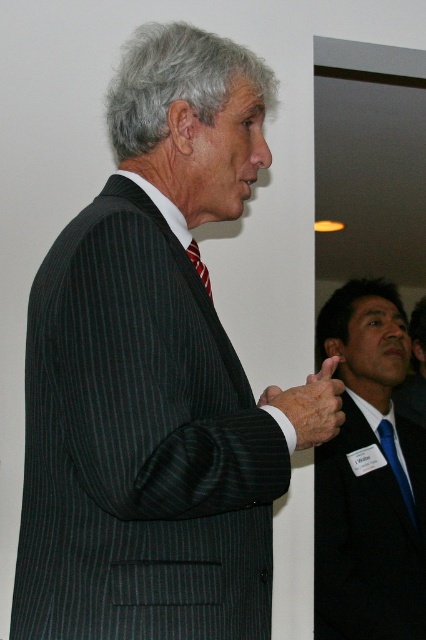
Is point (293, 390) more distant than point (201, 268)?

No, it is not.

Is matte black hand at center closer to the viewer compared to red striped tie at center?

That is True.

Locate an element on the screen. matte black hand at center is located at coordinates (313, 404).

In the scene shown: Can you confirm if matte black hand at center is thinner than blue silk tie at right?

Incorrect, matte black hand at center's width is not less than blue silk tie at right's.

Which is in front, point (307, 406) or point (402, 481)?

Positioned in front is point (307, 406).

Which is in front, point (287, 403) or point (393, 470)?

Point (287, 403)

I want to click on matte black hand at center, so click(313, 404).

Is the position of matte black suit at center more distant than that of matte black hand at center?

Yes.

Is point (391, 582) farther from viewer compared to point (337, 410)?

Yes, point (391, 582) is behind point (337, 410).

The width and height of the screenshot is (426, 640). In order to click on matte black suit at center in this screenshot , I will do `click(368, 534)`.